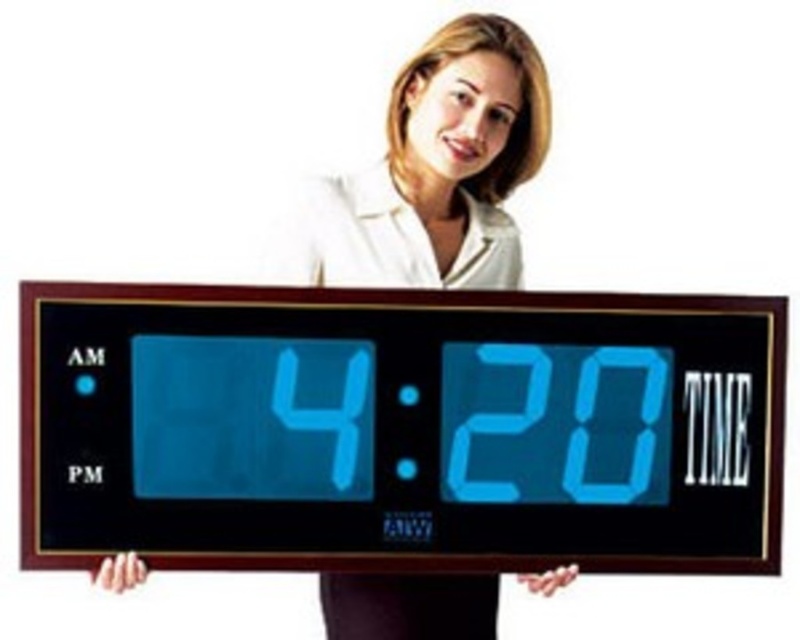
You are a photographer taking a picture of the digital clock. You notice two points on the clock face at coordinates point (434,342) and point (500,272). Which point will appear larger in your photo?

Point (434,342) is closer to the camera than point (500,272), so it will appear larger in the photo.

You are trying to determine the spatial relationship between the blue lcd display at center and the white smooth shirt at upper center. Based on the scene, which object is wider?

The blue lcd display at center is wider than the white smooth shirt at upper center according to the description.

You are a photographer trying to capture a photo of the blue lcd display at center and the white smooth shirt at upper center in the image. Which object should you focus on first if you want to ensure both are in focus without moving the camera?

The blue lcd display at center is to the left of white smooth shirt at upper center. Since they are positioned at different distances from the camera, you should focus on the object that is farther away to maximize depth of field. However, the description only states their spatial relationship, not their distances. Without additional information on depth, it is recommended to focus on the blue lcd display at center as it is closer to the center of the image, which is typically where autofocus prioritizes.